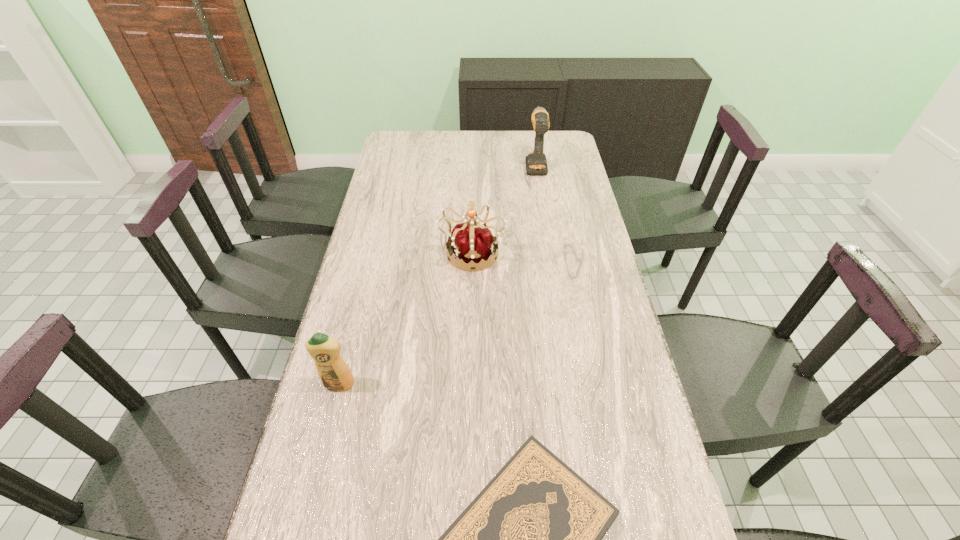
You are a GUI agent. You are given a task and a screenshot of the screen. Output one action in this format:
    pyautogui.click(x=<x>, y=<y>)
    Task: Click on the drill
    Image resolution: width=960 pixels, height=540 pixels.
    Given the screenshot: What is the action you would take?
    pyautogui.click(x=536, y=163)

Find the location of a particular element. Image resolution: width=960 pixels, height=540 pixels. tiara is located at coordinates (475, 245).

Where is `the leftmost object`? This screenshot has width=960, height=540. the leftmost object is located at coordinates (334, 373).

This screenshot has width=960, height=540. In order to click on detergent in this screenshot , I will do `click(334, 373)`.

This screenshot has height=540, width=960. I want to click on free space located 0.150m with the drill bit of the farthest object facing forward, so click(x=531, y=135).

Where is `free spot located on the front-facing side of the tiara`? The height and width of the screenshot is (540, 960). free spot located on the front-facing side of the tiara is located at coordinates (469, 372).

This screenshot has height=540, width=960. What are the coordinates of `free space located on the label of the third farthest object` in the screenshot? It's located at point(321,456).

I want to click on object present at the far edge, so click(x=536, y=163).

Image resolution: width=960 pixels, height=540 pixels. Find the location of `object located in the left edge section of the desktop`. object located in the left edge section of the desktop is located at coordinates (334, 373).

You are a GUI agent. You are given a task and a screenshot of the screen. Output one action in this format:
    pyautogui.click(x=<x>, y=<y>)
    Task: Click on the object located in the right edge section of the desktop
    
    Given the screenshot: What is the action you would take?
    pyautogui.click(x=536, y=163)